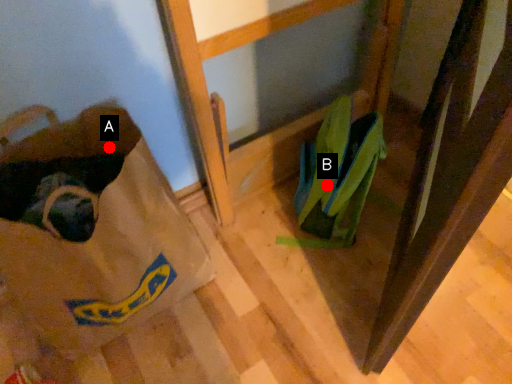
Question: Two points are circled on the image, labeled by A and B beside each circle. Which point is further to the camera?

Choices:
 (A) A is further
 (B) B is further

Answer: (B)